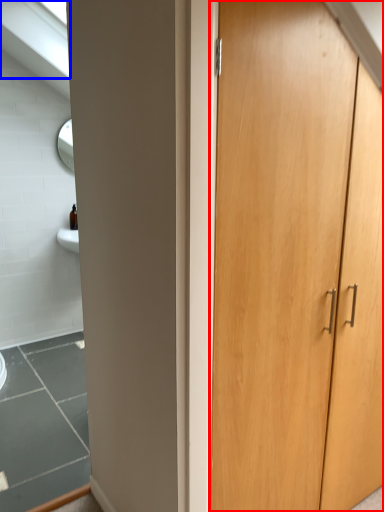
Question: Among these objects, which one is farthest to the camera, cupboard (highlighted by a red box) or window (highlighted by a blue box)?

Choices:
 (A) cupboard
 (B) window

Answer: (B)